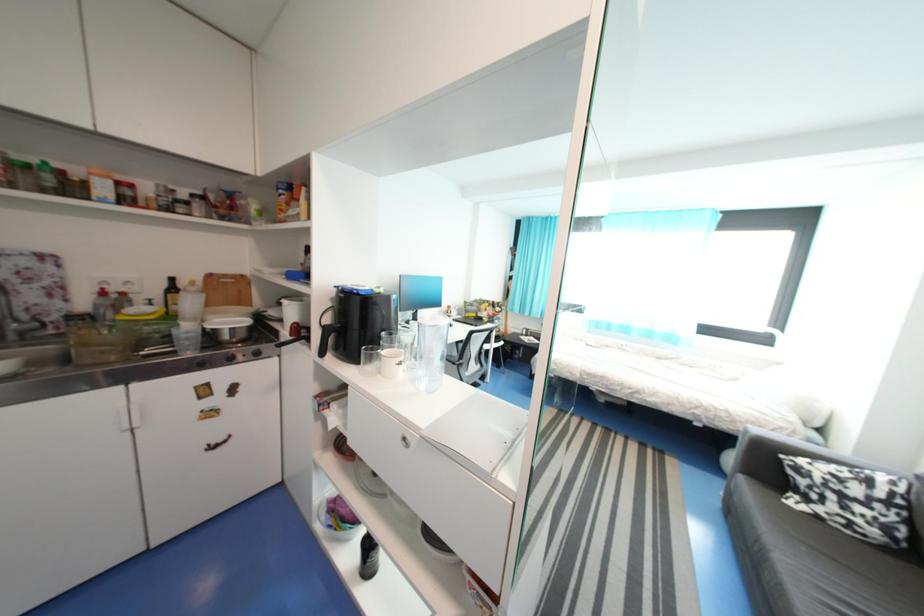
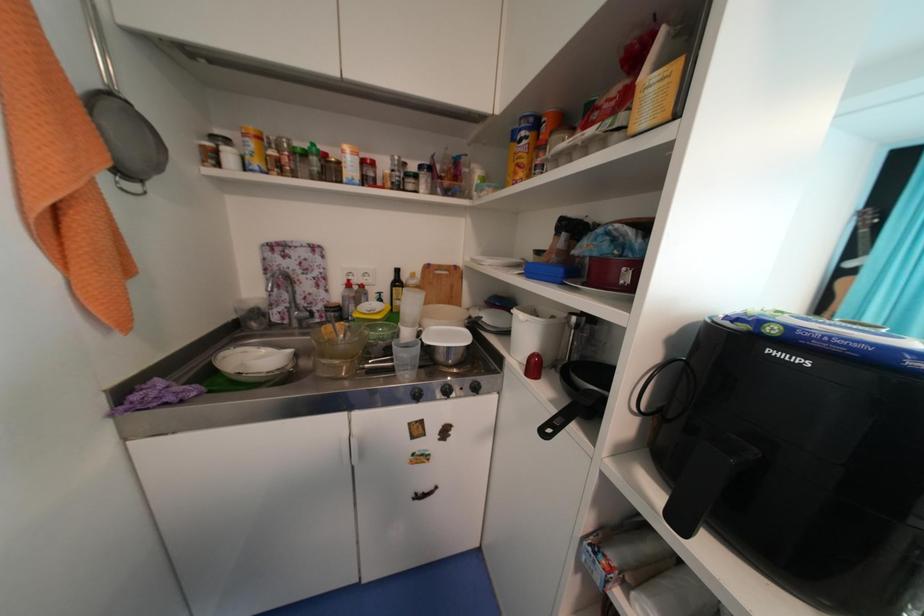
Question: How did the camera likely rotate?

Choices:
 (A) Left
 (B) Right
 (C) Up
 (D) Down

Answer: (A)